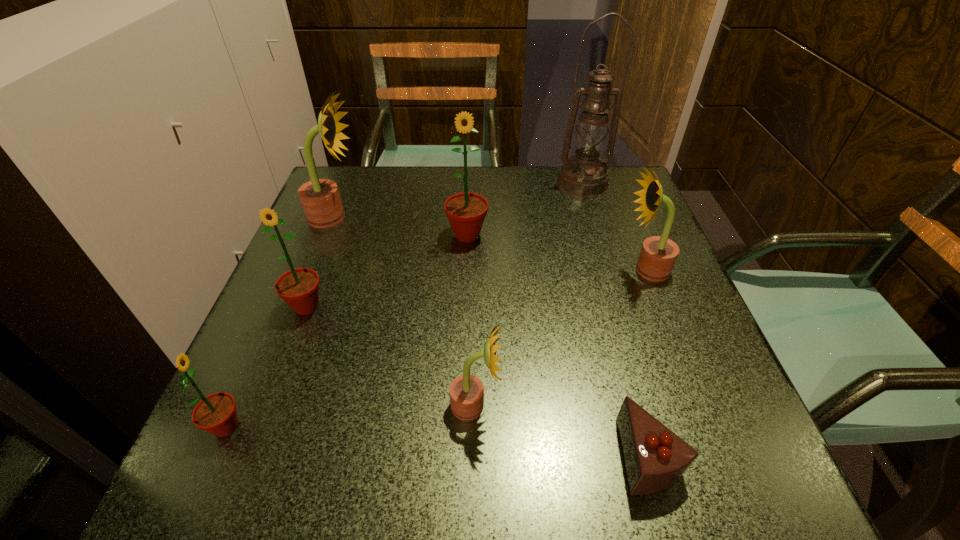
Find the location of a particular element. Image resolution: width=960 pixels, height=540 pixels. the farthest object is located at coordinates (584, 175).

Locate an element on the screen. The width and height of the screenshot is (960, 540). oil lamp is located at coordinates (584, 175).

Find the location of a particular element. Image resolution: width=960 pixels, height=540 pixels. the leftmost yellow sunflower is located at coordinates (320, 198).

At what (x,y) coordinates should I click in order to perform the action: click on the biggest yellow sunflower. Please return your answer as a coordinate pair (x, y). The width and height of the screenshot is (960, 540). Looking at the image, I should click on (320, 198).

Locate an element on the screen. The width and height of the screenshot is (960, 540). the farthest green sunflower is located at coordinates (466, 212).

Find the location of a particular element. Image resolution: width=960 pixels, height=540 pixels. the biggest green sunflower is located at coordinates (466, 212).

Image resolution: width=960 pixels, height=540 pixels. I want to click on the third farthest sunflower, so click(x=658, y=254).

Image resolution: width=960 pixels, height=540 pixels. I want to click on the second biggest yellow sunflower, so click(x=658, y=254).

Identify the location of the fourth nearest object. (299, 288).

At what (x,y) coordinates should I click in order to perform the action: click on the second farthest green sunflower. Please return your answer as a coordinate pair (x, y). This screenshot has width=960, height=540. Looking at the image, I should click on (299, 288).